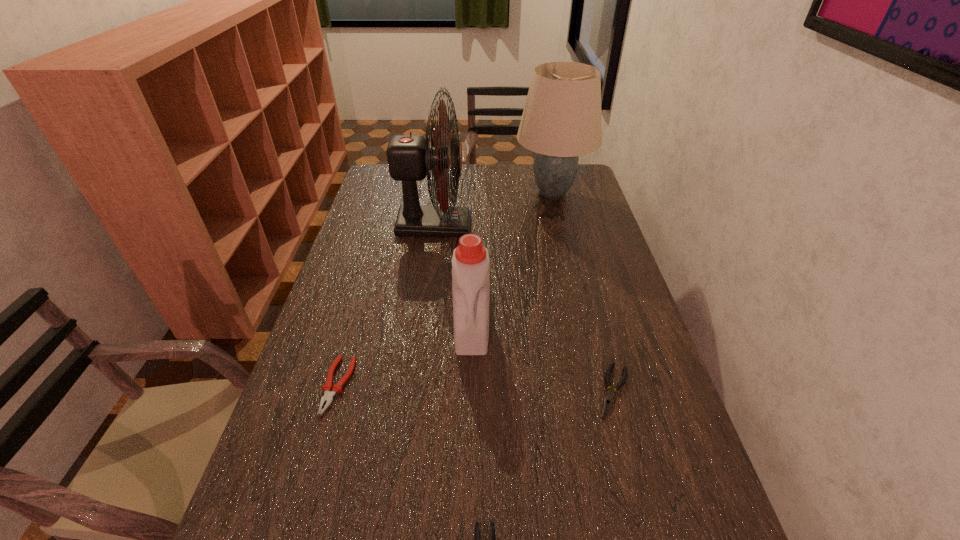
Identify which pliers is the closest to the nearest object. Please provide its 2D coordinates. Your answer should be formatted as a tuple, i.e. [(x, y)], where the tuple contains the x and y coordinates of a point satisfying the conditions above.

[(608, 400)]

At what (x,y) coordinates should I click in order to perform the action: click on free space that satisfies the following two spatial constraints: 1. on the handle side of the fourth shortest object; 2. on the left side of the rightmost pliers. Please return your answer as a coordinate pair (x, y). Looking at the image, I should click on (470, 391).

I want to click on free spot that satisfies the following two spatial constraints: 1. on the front side of the lampshade; 2. on the front-facing side of the fan, so click(561, 225).